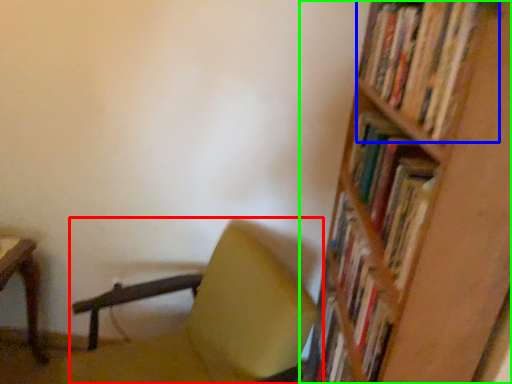
Question: Based on their relative distances, which object is nearer to chair (highlighted by a red box)? Choose from book (highlighted by a blue box) and shelf (highlighted by a green box).

Choices:
 (A) book
 (B) shelf

Answer: (B)